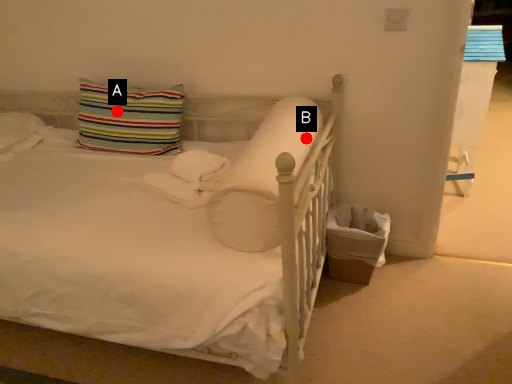
Question: Two points are circled on the image, labeled by A and B beside each circle. Among these points, which one is nearest to the camera?

Choices:
 (A) A is closer
 (B) B is closer

Answer: (B)